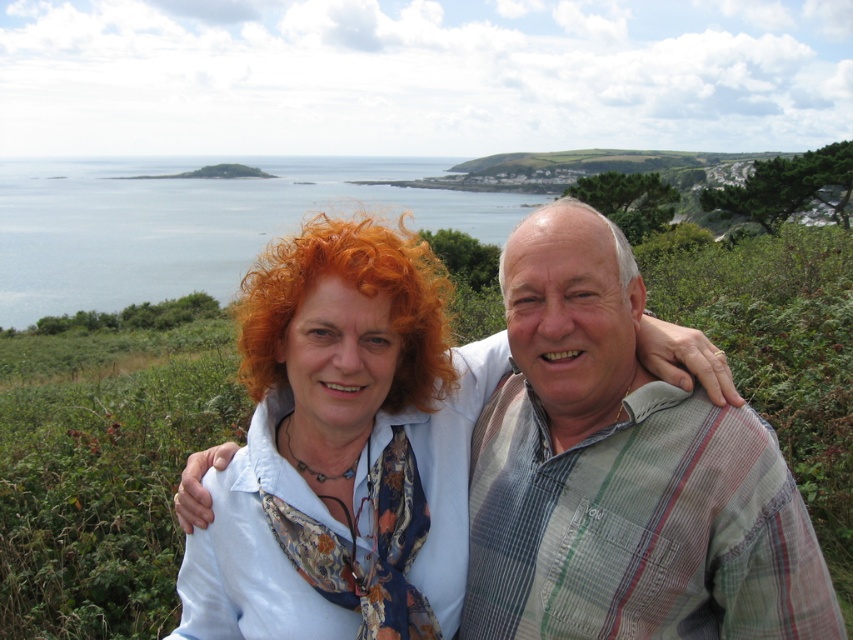
You are a photographer trying to capture the striped cotton shirt at center in your shot. You notice a point marked at coordinates (622, 474). Where should you aim your camera to ensure the striped cotton shirt at center is in focus?

The point at (622, 474) corresponds to the striped cotton shirt at center, so aim your camera at that coordinate to focus on the striped cotton shirt at center.

From the picture: You are a photographer trying to capture the striped cotton shirt at center in your shot. You want to ensure the shirt is centered in the frame. Is the shirt already centered in the image?

The striped cotton shirt at center is located at coordinates point (622,474), which indicates it is already centered in the image.

What is the location of the curly orange hair at center in the image?

The curly orange hair at center is located at point (357, 291).